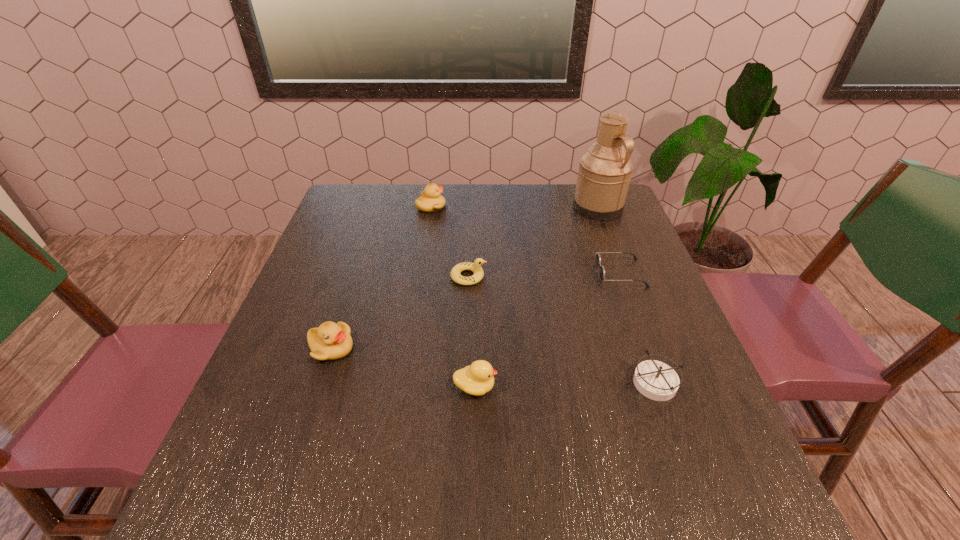
Locate an element on the screen. free spot between the compass and the shortest object is located at coordinates (637, 327).

In order to click on vacant space that's between the third duckling from right to left and the leftmost duckling in this screenshot , I will do `click(381, 277)`.

This screenshot has height=540, width=960. What are the coordinates of `vacant area that lies between the shortest object and the tallest object` in the screenshot? It's located at (610, 240).

Image resolution: width=960 pixels, height=540 pixels. I want to click on free space between the sunglasses and the farthest duckling, so click(526, 240).

In order to click on free space between the tallest object and the nearest duckling in this screenshot , I will do `click(537, 298)`.

The image size is (960, 540). What are the coordinates of `free space between the shortest duckling and the third duckling from right to left` in the screenshot? It's located at (449, 241).

Find the location of a particular element. The height and width of the screenshot is (540, 960). empty space between the sunglasses and the farthest duckling is located at coordinates (526, 240).

Find the location of `vacant region between the compass and the leftmost object`. vacant region between the compass and the leftmost object is located at coordinates click(x=492, y=364).

Locate an element on the screen. Image resolution: width=960 pixels, height=540 pixels. the second closest object relative to the compass is located at coordinates (477, 379).

Identify which object is the second closest to the leftmost object. Please provide its 2D coordinates. Your answer should be formatted as a tuple, i.e. [(x, y)], where the tuple contains the x and y coordinates of a point satisfying the conditions above.

[(476, 267)]